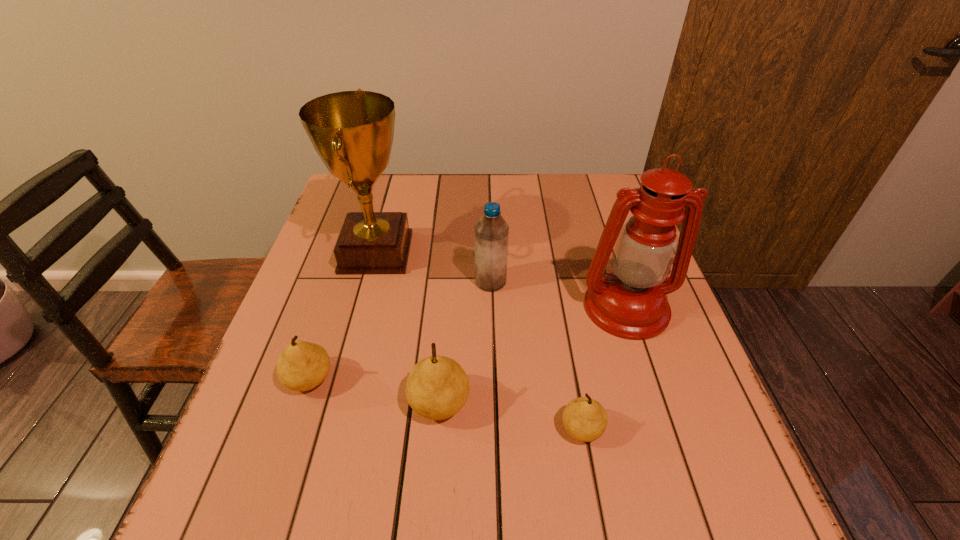
This screenshot has width=960, height=540. What are the coordinates of `vacant position located on the back of the fifth tallest object` in the screenshot? It's located at (354, 245).

The height and width of the screenshot is (540, 960). In order to click on vacant area located on the right of the tallest pear in this screenshot , I will do `click(585, 403)`.

You are a GUI agent. You are given a task and a screenshot of the screen. Output one action in this format:
    pyautogui.click(x=<x>, y=<y>)
    Task: Click on the free space located 0.160m on the right of the rightmost pear
    The image size is (960, 540).
    Given the screenshot: What is the action you would take?
    [690, 429]

Identify the location of free region located on the plaque of the award. (484, 252).

I want to click on free space located 0.330m on the left of the fourth shortest object, so click(x=342, y=282).

This screenshot has height=540, width=960. Find the location of `vacant space located on the back of the rightmost object`. vacant space located on the back of the rightmost object is located at coordinates (593, 206).

Find the location of a particular element. The width and height of the screenshot is (960, 540). pear located at the left edge is located at coordinates (x=302, y=366).

Locate an element on the screen. award at the left edge is located at coordinates (352, 131).

This screenshot has width=960, height=540. I want to click on object situated at the right edge, so click(x=630, y=302).

Find the location of a particular element. free space at the far edge of the desktop is located at coordinates (502, 180).